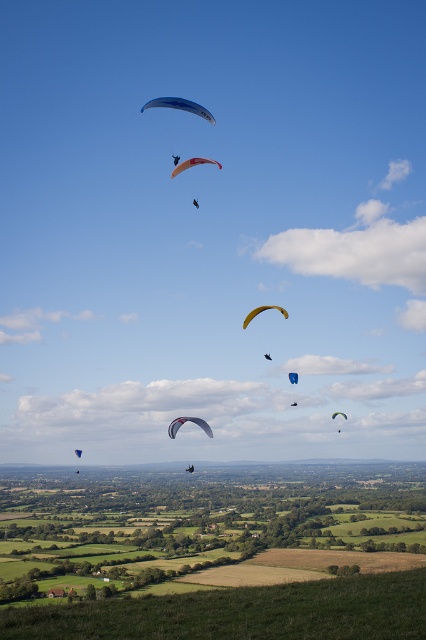
Question: Considering the relative positions of blue fabric parachute at upper center and matte blue parachute at upper center in the image provided, where is blue fabric parachute at upper center located with respect to matte blue parachute at upper center?

Choices:
 (A) below
 (B) above

Answer: (B)

Question: Which object is the closest to the matte black paraglider at upper center?

Choices:
 (A) green fabric parachute at center
 (B) orange fabric parachute at center
 (C) matte blue parachute at upper center
 (D) blue glossy parachute at upper center

Answer: (C)

Question: Which of the following is the farthest from the observer?

Choices:
 (A) (215, 163)
 (B) (256, 310)

Answer: (A)

Question: Does matte blue parachute at upper center lie in front of blue fabric parachute at center?

Choices:
 (A) no
 (B) yes

Answer: (B)

Question: Can you confirm if blue fabric parachute at upper center is positioned to the right of white matte parachute at center?

Choices:
 (A) yes
 (B) no

Answer: (B)

Question: Which object is farther from the camera taking this photo?

Choices:
 (A) green fabric parachute at center
 (B) matte blue parachute at upper center

Answer: (A)